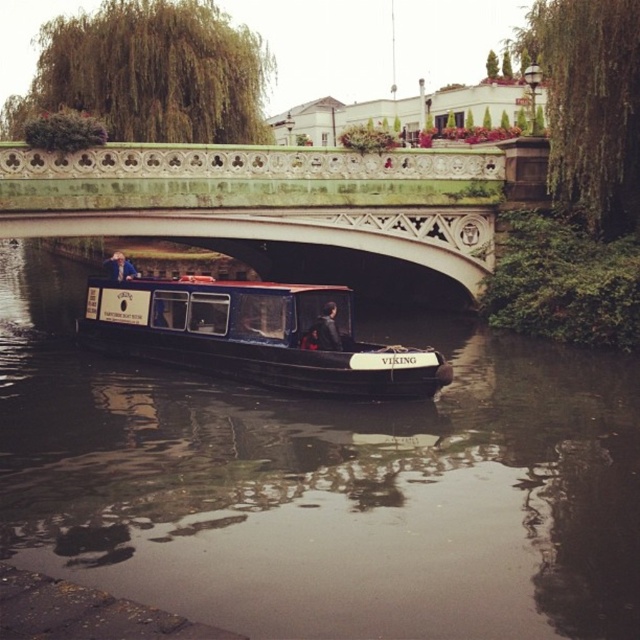
Between dark brown water at center and black polished wood barge at center, which one appears on the right side from the viewer's perspective?

From the viewer's perspective, dark brown water at center appears more on the right side.

Does point (102, 413) come closer to viewer compared to point (198, 305)?

Yes.

Which is behind, point (577, 604) or point (262, 337)?

Positioned behind is point (262, 337).

Where is `dark brown water at center`? Image resolution: width=640 pixels, height=640 pixels. dark brown water at center is located at coordinates (324, 483).

Does green stone bridge at upper center have a larger size compared to black polished wood barge at center?

Correct, green stone bridge at upper center is larger in size than black polished wood barge at center.

Which of these two, green stone bridge at upper center or black polished wood barge at center, stands taller?

green stone bridge at upper center is taller.

Where is `green stone bridge at upper center`? This screenshot has height=640, width=640. green stone bridge at upper center is located at coordinates pyautogui.click(x=275, y=208).

Find the location of `green stone bridge at upper center`. green stone bridge at upper center is located at coordinates (275, 208).

Which of these two, dark brown water at center or green stone bridge at upper center, stands shorter?

With less height is dark brown water at center.

Who is positioned more to the left, dark brown water at center or green stone bridge at upper center?

From the viewer's perspective, green stone bridge at upper center appears more on the left side.

Does point (598, 468) come behind point (42, 220)?

No, it is in front of (42, 220).

This screenshot has height=640, width=640. What are the coordinates of `dark brown water at center` in the screenshot? It's located at (324, 483).